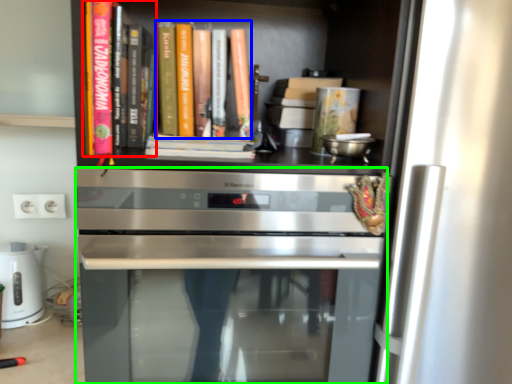
Question: Estimate the real-world distances between objects in this image. Which object is closer to book (highlighted by a red box), book (highlighted by a blue box) or oven (highlighted by a green box)?

Choices:
 (A) book
 (B) oven

Answer: (A)